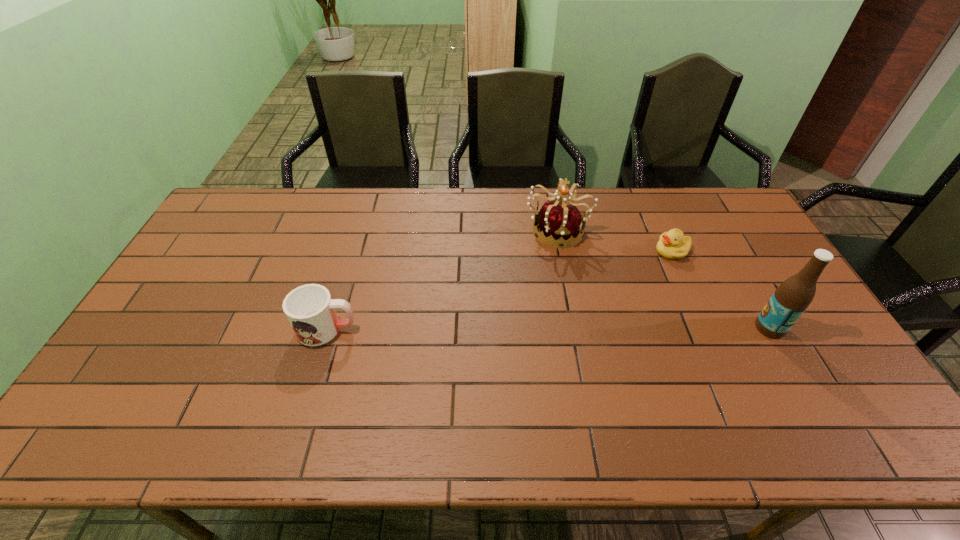
Image resolution: width=960 pixels, height=540 pixels. What are the coordinates of `free spot between the tiara and the leftmost object` in the screenshot? It's located at (442, 279).

Locate an element on the screen. free spot between the tiara and the tallest object is located at coordinates pyautogui.click(x=663, y=279).

Where is `free space between the second object from left to right and the beer bottle`? The height and width of the screenshot is (540, 960). free space between the second object from left to right and the beer bottle is located at coordinates (663, 279).

What are the coordinates of `vacant point located between the tiara and the rightmost object` in the screenshot? It's located at (663, 279).

Locate an element on the screen. The width and height of the screenshot is (960, 540). object that is the nearest to the second object from right to left is located at coordinates (563, 222).

This screenshot has width=960, height=540. In order to click on object that stands as the third closest to the shortest object in this screenshot , I will do point(310,310).

Find the location of `vacant region that satisfies the following two spatial constraints: 1. on the front side of the tiara; 2. on the right side of the tallest object`. vacant region that satisfies the following two spatial constraints: 1. on the front side of the tiara; 2. on the right side of the tallest object is located at coordinates (576, 328).

You are a GUI agent. You are given a task and a screenshot of the screen. Output one action in this format:
    pyautogui.click(x=<x>, y=<y>)
    Task: Click on the vacant space that satisfies the following two spatial constraints: 1. on the front side of the tallest object; 2. on the left side of the tiara
    The image size is (960, 540).
    Given the screenshot: What is the action you would take?
    tap(576, 328)

You are a GUI agent. You are given a task and a screenshot of the screen. Output one action in this format:
    pyautogui.click(x=<x>, y=<y>)
    Task: Click on the free location that satisfies the following two spatial constraints: 1. on the front side of the second object from left to right; 2. on the left side of the shortest object
    
    Given the screenshot: What is the action you would take?
    pyautogui.click(x=562, y=251)